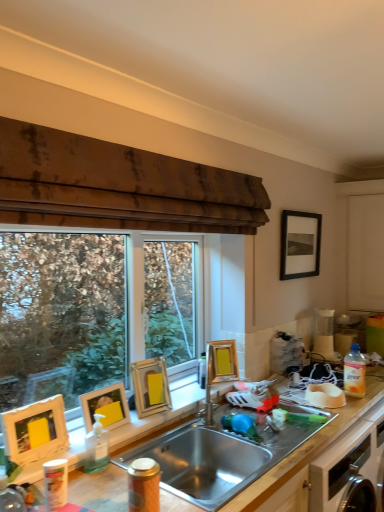
Find the location of a particular element. free space in front of white matte bowl at right is located at coordinates (338, 411).